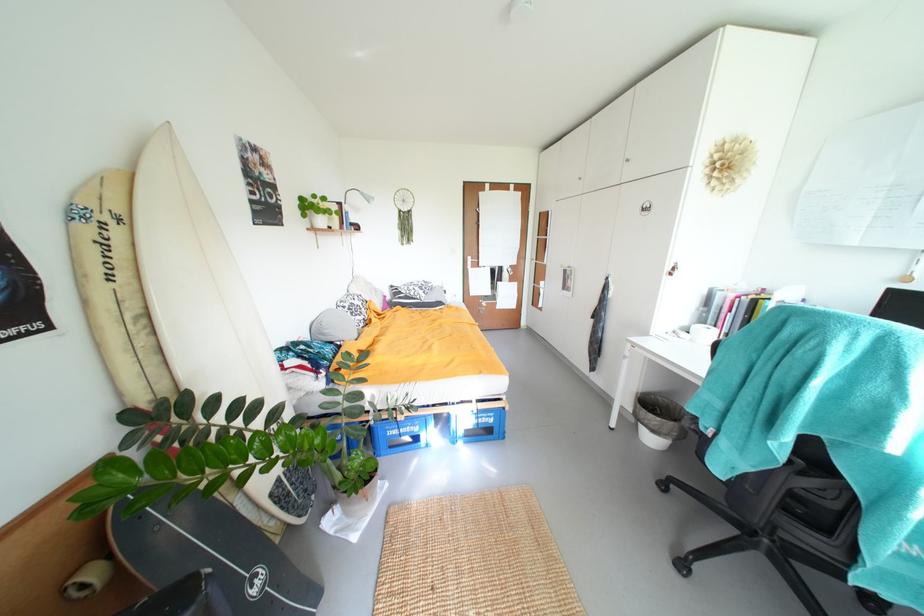
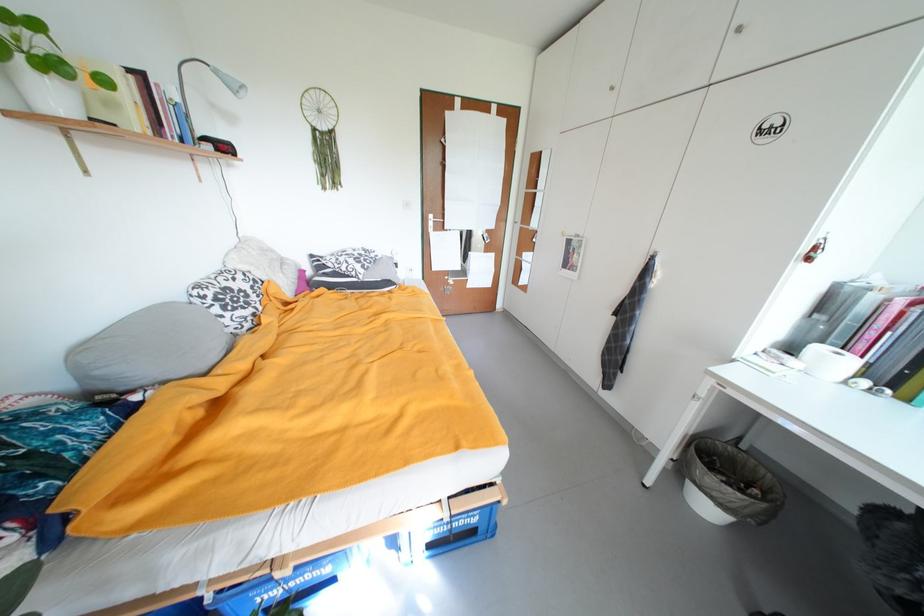
The point at (x=499, y=422) is marked in the first image. Where is the corresponding point in the second image?

(482, 522)